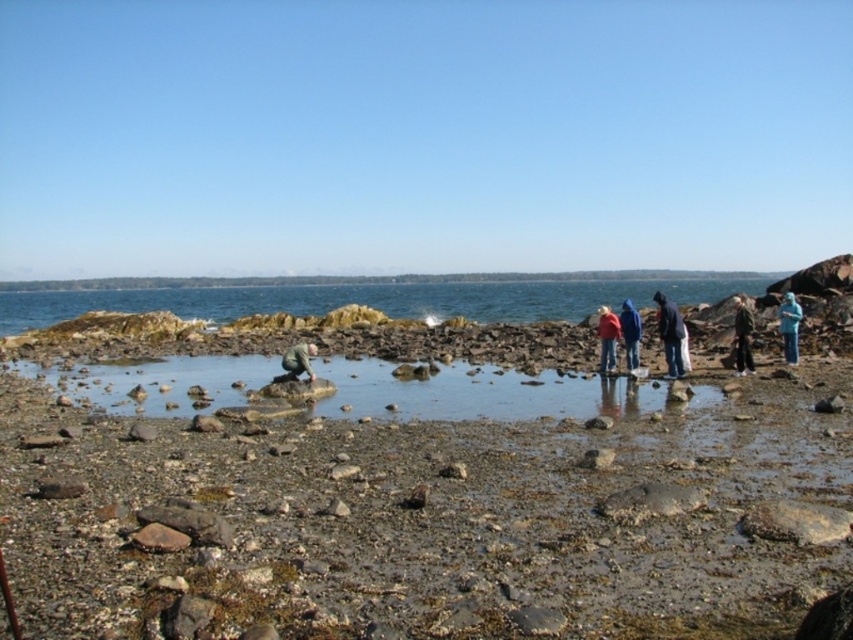
You are a photographer standing at the camera position. You want to capture a photo of the dark blue jacket at right without including the tidal pool in the frame. Is it possible to do so given the distance?

The dark blue jacket at right is 20.32 meters away from the camera. Since the tidal pool is in the middle ground and the jacket is further away, you can adjust your camera angle or position to exclude the tidal pool while focusing on the jacket.

You are standing on the rocky shoreline and want to place your dark brown leather jacket on a flat surface. Which object between the smooth pebbles at center and the dark brown leather jacket at right can you use as a flat surface?

The smooth pebbles at center are shorter than the dark brown leather jacket at right, so you can place the jacket on the smooth pebbles at center since they provide a flatter surface.